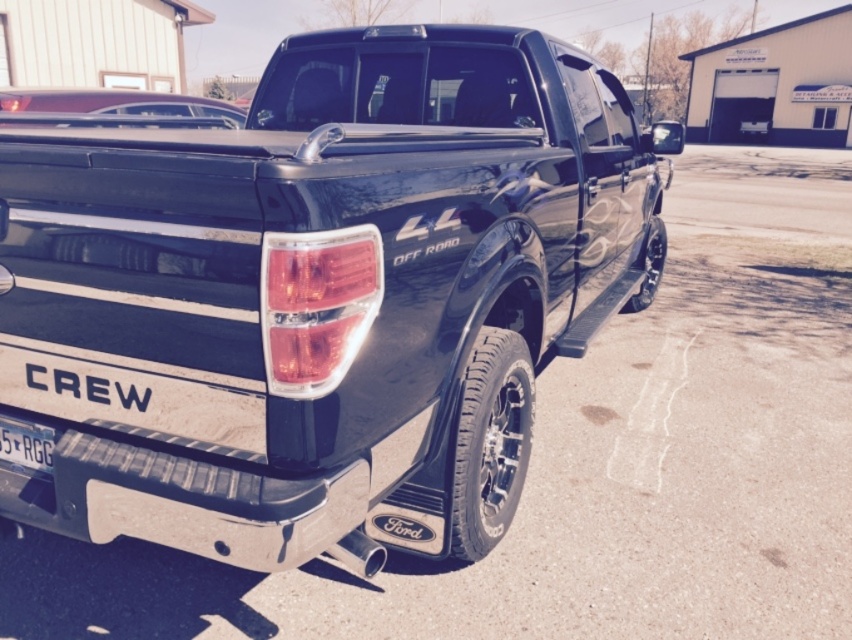
You are standing in front of the black Ford F150 Crew Cab pickup truck. There are two points marked on the truck, one at point (450, 49) and the other at point (52, 468). Which point is closer to you?

Point (52, 468) is closer to you because it is less further to the camera than point (450, 49).

You are standing at the entrance of a dealership and want to locate the glossy black truck at center. According to the coordinates provided, where should you look relative to the dealership entrance?

The glossy black truck at center is located at coordinates point (321, 294), which would be to the right and slightly forward from the dealership entrance.